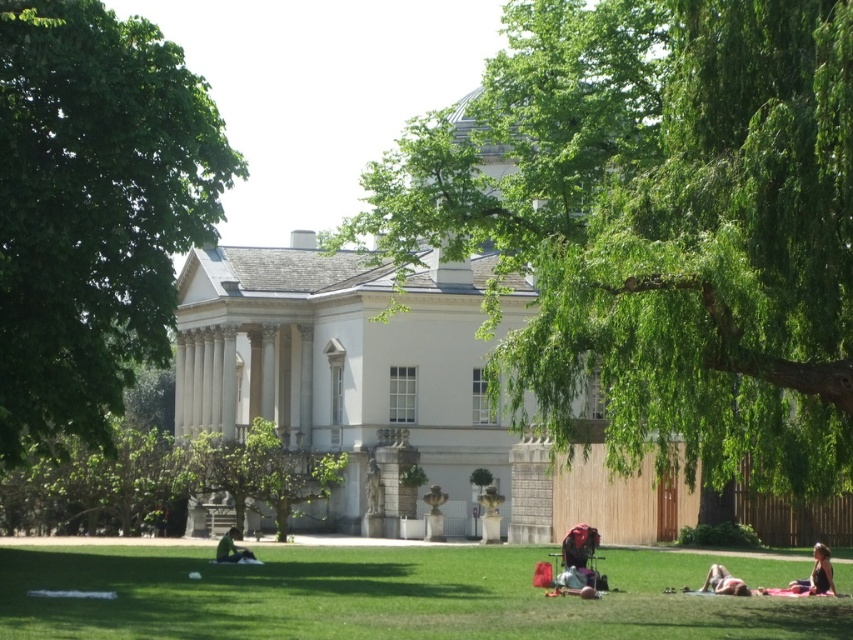
You are a photographer positioned at the edge of the grassy area in the park scene. You want to capture a photo that includes both the black fabric person at lower right and the skinny jeans at lower right. To ensure both subjects are in frame, should you adjust your camera to the left or right? Explain your reasoning based on their positions.

Since the black fabric person at lower right is to the right of the skinny jeans at lower right, you should adjust your camera slightly to the left to include both subjects in the frame. This way, the camera will capture the area where both the black fabric person at lower right and the skinny jeans at lower right are positioned.

You are planning to set up a picnic blanket in the park. Considering the green leafy tree at center and the green grass at lower center, which area would provide more shade?

The green leafy tree at center is much taller than the green grass at lower center, so it would provide more shade for your picnic blanket.

You are standing in the park and want to take a photo of the classical building in the background. You notice a specific point at coordinates point (634, 264) in your viewfinder. If the distance from your camera to this point is 166.02 feet, will you be able to capture the entire classical building in your shot without moving your position?

The distance of point (634, 264) from camera is 166.02 feet. Since the classical building is in the background, it is likely farther away than this point. Therefore, if the point is closer than the building, capturing the entire building might require a wider angle or adjusting your framing. However, without knowing the building distance, it is uncertain.